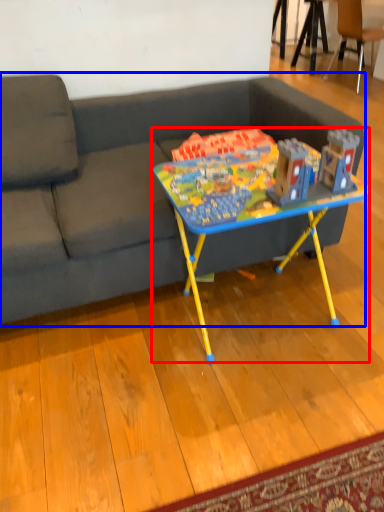
Question: Among these objects, which one is nearest to the camera, table (highlighted by a red box) or studio couch (highlighted by a blue box)?

Choices:
 (A) table
 (B) studio couch

Answer: (B)